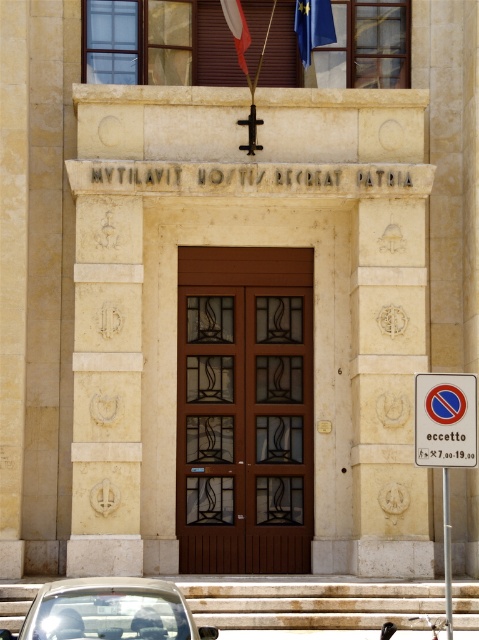
Question: Which point appears farthest from the camera in this image?

Choices:
 (A) (465, 417)
 (B) (310, 8)

Answer: (B)

Question: Does blue fabric flag at upper center appear on the left side of red fabric flag at upper center?

Choices:
 (A) no
 (B) yes

Answer: (A)

Question: Does brown wooden door at center appear over red fabric flag at upper center?

Choices:
 (A) no
 (B) yes

Answer: (A)

Question: Which of these objects is positioned closest to the brown wooden door at center?

Choices:
 (A) white plastic sign at lower right
 (B) matte black car at lower center

Answer: (A)

Question: Based on their relative distances, which object is nearer to the white plastic sign at right?

Choices:
 (A) white plastic sign at lower right
 (B) matte black car at lower center
 (C) blue fabric flag at upper center
 (D) brown wooden door at center

Answer: (A)

Question: Can you confirm if white plastic sign at right is positioned to the left of white plastic sign at lower right?

Choices:
 (A) no
 (B) yes

Answer: (A)